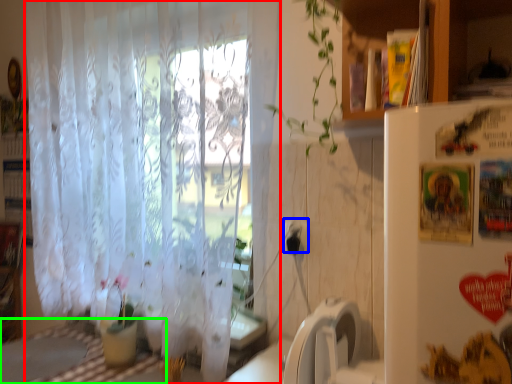
Question: Considering the real-world distances, which object is closest to curtain (highlighted by a red box)? electric outlet (highlighted by a blue box) or table (highlighted by a green box).

Choices:
 (A) electric outlet
 (B) table

Answer: (B)